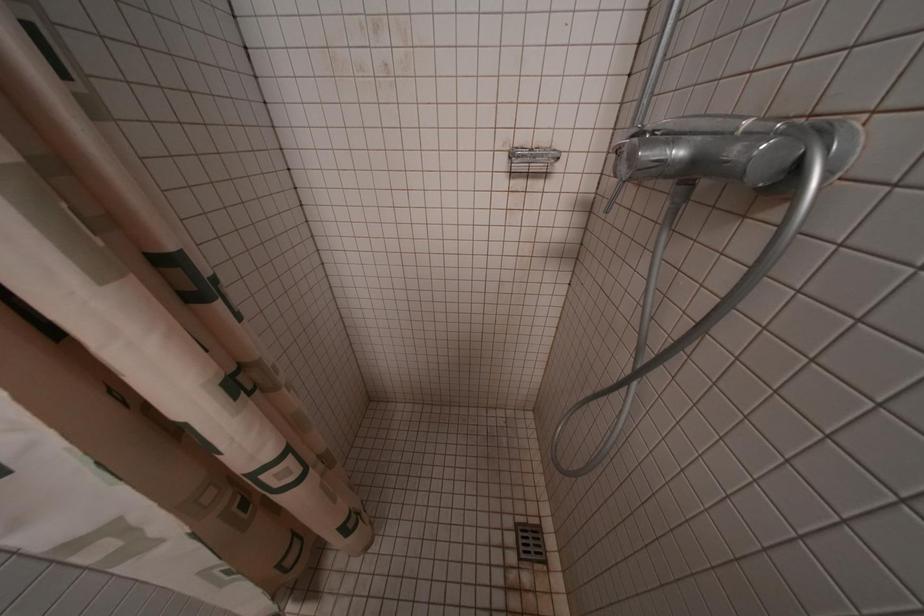
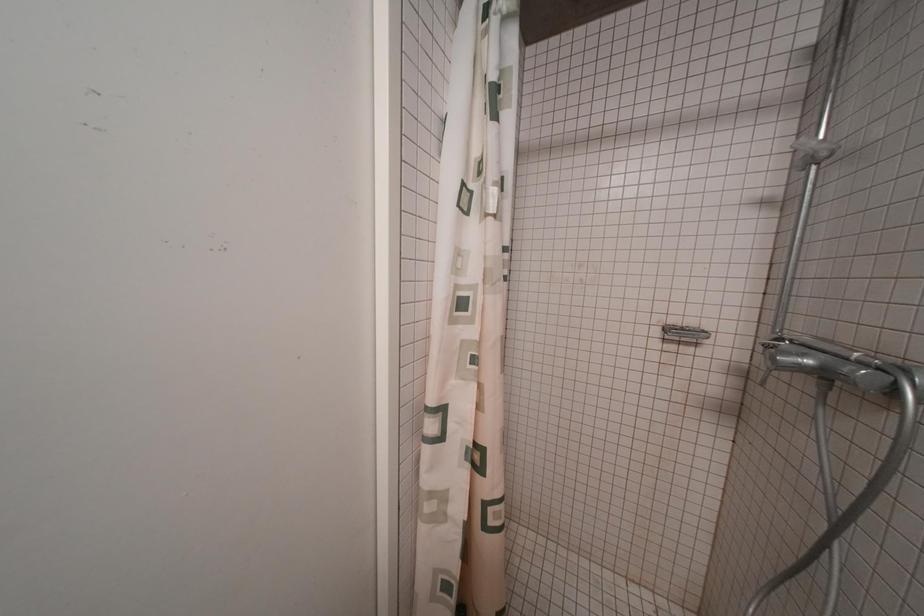
How did the camera likely rotate?

The camera's rotation is toward left-up.